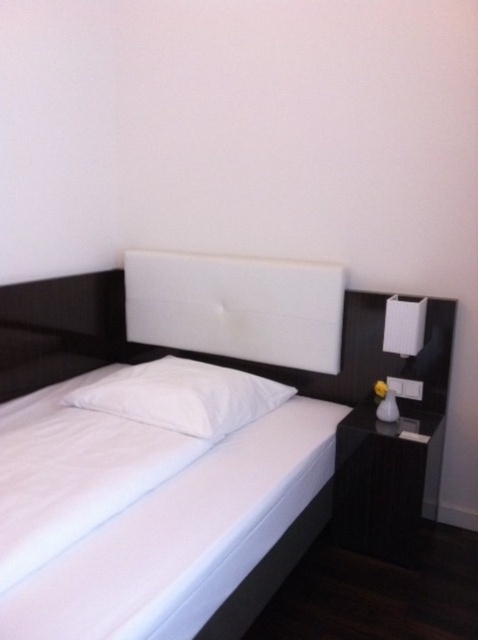
Who is positioned more to the left, white leather bed at center or white leather headboard at center?

white leather bed at center is more to the left.

Between point (409, 506) and point (174, 317), which one is positioned in front?

Point (409, 506)

Identify the location of white leather bed at center. The height and width of the screenshot is (640, 478). (192, 442).

Measure the distance between point (75, 496) and camera.

Point (75, 496) and camera are 5.52 feet apart from each other.

You are a GUI agent. You are given a task and a screenshot of the screen. Output one action in this format:
    pyautogui.click(x=<x>, y=<y>)
    Task: Click on the white smooth bedsheet at center
    The width and height of the screenshot is (478, 640).
    Given the screenshot: What is the action you would take?
    pyautogui.click(x=74, y=470)

Which is more to the right, white smooth bedsheet at center or white soft pillow at center?

white soft pillow at center is more to the right.

Is white smooth bedsheet at center taller than white soft pillow at center?

Yes.

Who is more distant from viewer, (14, 445) or (184, 372)?

The point (184, 372) is more distant.

At what (x,y) coordinates should I click in order to perform the action: click on white smooth bedsheet at center. Please return your answer as a coordinate pair (x, y). The image size is (478, 640). Looking at the image, I should click on (74, 470).